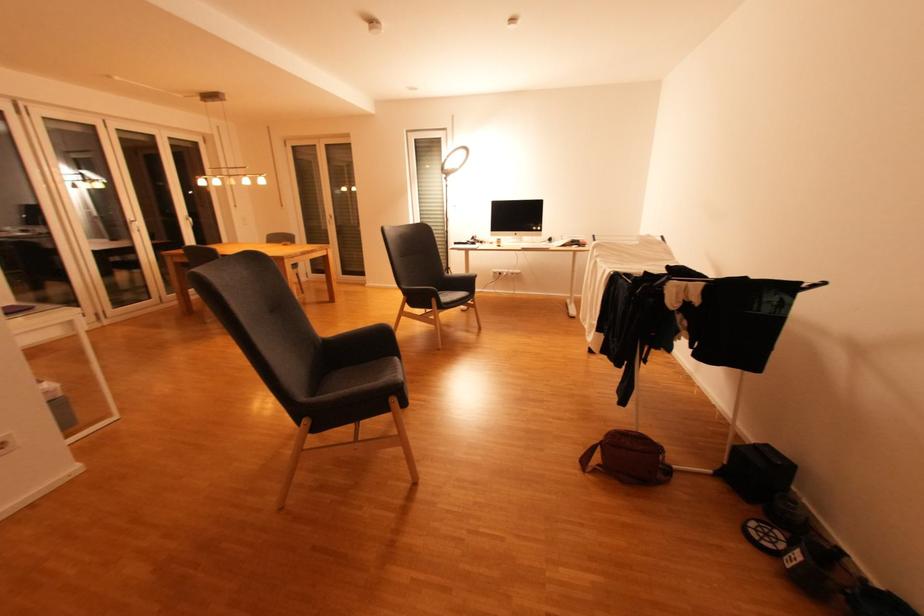
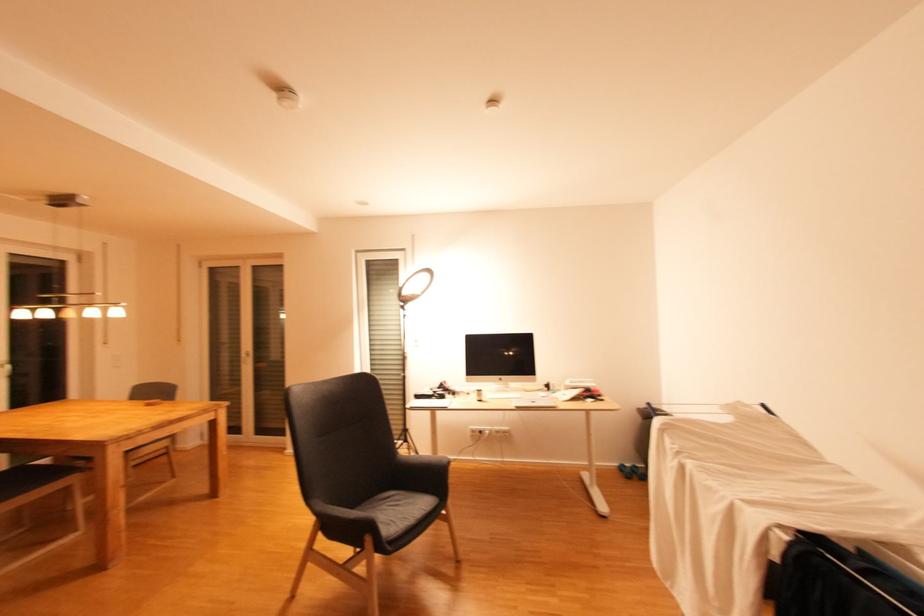
Question: In a continuous first-person perspective shot, in which direction is the camera moving?

Choices:
 (A) Left
 (B) Right
 (C) Forward
 (D) Backward

Answer: (C)